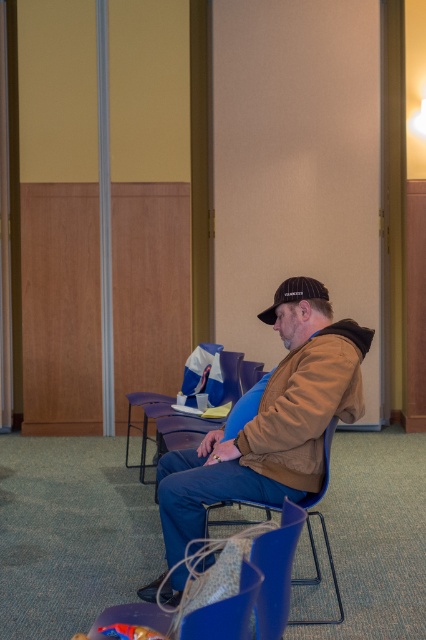
Question: Does blue plastic chair at center appear on the left side of black matte baseball cap at center?

Choices:
 (A) yes
 (B) no

Answer: (A)

Question: Where is brown suede jacket at center located in relation to black matte baseball cap at center in the image?

Choices:
 (A) left
 (B) right

Answer: (A)

Question: Considering the real-world distances, which object is closest to the black matte baseball cap at center?

Choices:
 (A) blue plastic chair at center
 (B) brown suede jacket at center

Answer: (B)

Question: Does blue plastic chair at center appear over black matte baseball cap at center?

Choices:
 (A) yes
 (B) no

Answer: (B)

Question: Which of the following is the closest to the observer?

Choices:
 (A) blue plastic chair at center
 (B) black matte baseball cap at center

Answer: (A)

Question: Estimate the real-world distances between objects in this image. Which object is farther from the brown suede jacket at center?

Choices:
 (A) blue plastic chair at center
 (B) black matte baseball cap at center

Answer: (B)